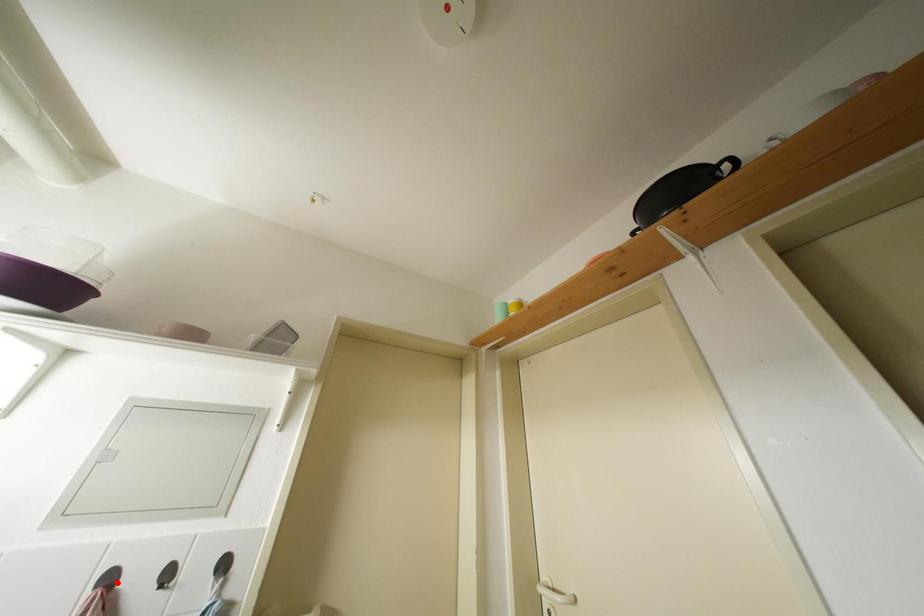
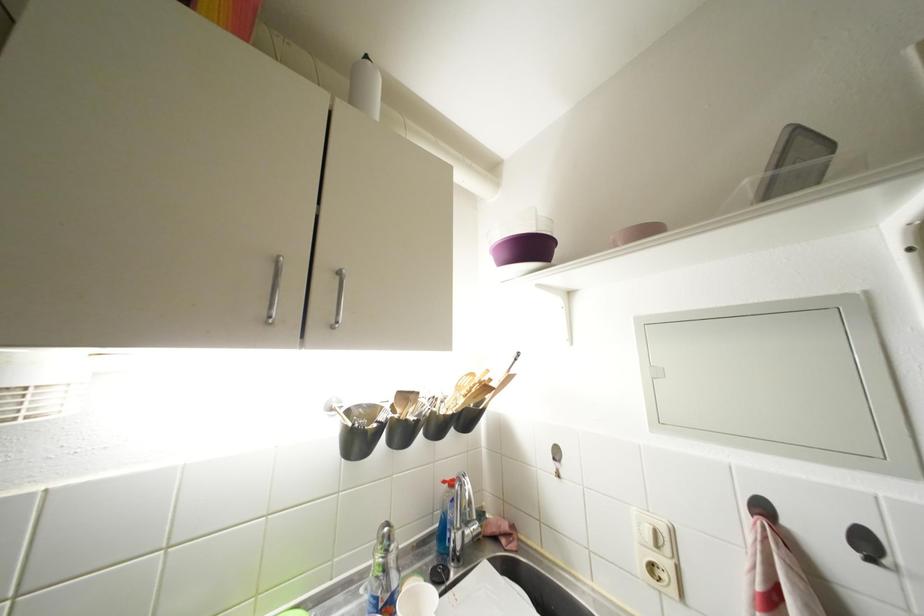
Question: I am providing you with two images of the same scene from different viewpoints. In image1, a red point is highlighted. Considering the same 3D point in image2, which of the following is correct?

Choices:
 (A) It is closer
 (B) It is farther

Answer: (B)